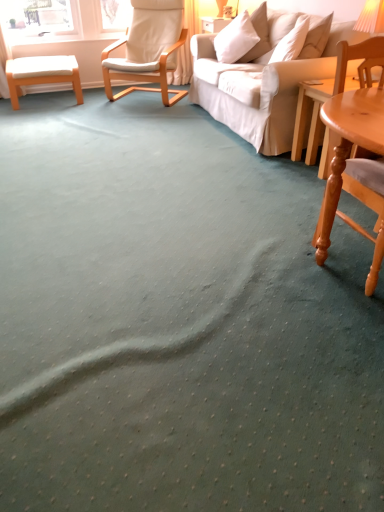
The height and width of the screenshot is (512, 384). I want to click on orange wood stool at left, so [x=42, y=74].

Where is `light wood chair at right, the 1th chair viewed from the right`? light wood chair at right, the 1th chair viewed from the right is located at coordinates (357, 198).

Identify the location of orange fabric lampshade at upper right. This screenshot has height=512, width=384. (371, 17).

Describe the element at coordinates (148, 49) in the screenshot. I see `white fabric chair at upper left, which ranks as the 2th chair in front-to-back order` at that location.

This screenshot has height=512, width=384. Find the location of `white soft pillow at upper right`. white soft pillow at upper right is located at coordinates (235, 39).

From the picture: From a real-world perspective, is light wood chair at right, the 1th chair viewed from the right, under white fabric chair at upper left, the second chair positioned from the right?

Yes, from a real-world perspective, light wood chair at right, the 1th chair viewed from the right, is beneath white fabric chair at upper left, the second chair positioned from the right.

Can you confirm if light wood chair at right, positioned as the first chair in front-to-back order, is wider than white fabric chair at upper left, the second chair positioned from the right?

No, light wood chair at right, positioned as the first chair in front-to-back order, is not wider than white fabric chair at upper left, the second chair positioned from the right.

Considering the points (367, 204) and (117, 77), which point is in front, point (367, 204) or point (117, 77)?

The point (367, 204) is closer.

Is white soft pillow at upper right at the right side of light wood chair at right, placed as the second chair when sorted from back to front?

No, white soft pillow at upper right is not to the right of light wood chair at right, placed as the second chair when sorted from back to front.

Looking at this image, would you say white soft pillow at upper right is inside or outside light wood chair at right, which is the 2th chair in top-to-bottom order?

white soft pillow at upper right is located beyond the bounds of light wood chair at right, which is the 2th chair in top-to-bottom order.

Locate an element on the screen. pillow behind the light wood chair at right, arranged as the first chair when ordered from the bottom is located at coordinates (235, 39).

Is white soft pillow at upper right further to the viewer compared to light wood chair at right, the 1th chair viewed from the right?

Yes, white soft pillow at upper right is further from the camera.

Could you tell me if white fabric chair at upper left, which ranks as the 2th chair in front-to-back order, is facing orange fabric lampshade at upper right?

No, white fabric chair at upper left, which ranks as the 2th chair in front-to-back order, is not turned towards orange fabric lampshade at upper right.

From a real-world perspective, between white fabric chair at upper left, which ranks as the 2th chair in front-to-back order, and orange fabric lampshade at upper right, who is vertically higher?

In real-world perspective, orange fabric lampshade at upper right is above.

Is white fabric chair at upper left, placed as the 1th chair when sorted from back to front, shorter than orange fabric lampshade at upper right?

No, white fabric chair at upper left, placed as the 1th chair when sorted from back to front, is not shorter than orange fabric lampshade at upper right.

From the image's perspective, is white soft pillow at upper right located above orange fabric lampshade at upper right?

Yes.

From a real-world perspective, is white soft pillow at upper right physically below orange fabric lampshade at upper right?

Yes, from a real-world perspective, white soft pillow at upper right is below orange fabric lampshade at upper right.

Which is behind, point (235, 42) or point (382, 0)?

Positioned behind is point (235, 42).

Does white soft pillow at upper right lie behind orange fabric lampshade at upper right?

Yes, it is.

Does white soft pillow at upper right have a lesser height compared to white fabric chair at upper left, which appears as the first chair when viewed from the top?

Yes.

Considering the sizes of objects white soft pillow at upper right and white fabric chair at upper left, the second chair positioned from the right, in the image provided, who is wider, white soft pillow at upper right or white fabric chair at upper left, the second chair positioned from the right,?

Wider between the two is white fabric chair at upper left, the second chair positioned from the right.

Relative to white fabric chair at upper left, which ranks as the 2th chair in front-to-back order, is white soft pillow at upper right in front or behind?

Visually, white soft pillow at upper right is located in front of white fabric chair at upper left, which ranks as the 2th chair in front-to-back order.

From the image's perspective, is white soft pillow at upper right located beneath white fabric chair at upper left, which ranks as the 2th chair in front-to-back order?

Yes, from the image's perspective, white soft pillow at upper right is below white fabric chair at upper left, which ranks as the 2th chair in front-to-back order.

Does white soft pillow at upper right have a smaller size compared to orange wood stool at left?

Yes.

Is white soft pillow at upper right oriented away from orange wood stool at left?

No, white soft pillow at upper right is not facing away from orange wood stool at left.

Is white soft pillow at upper right inside or outside of orange wood stool at left?

white soft pillow at upper right lies outside orange wood stool at left.

From the image's perspective, is white soft pillow at upper right above orange wood stool at left?

Yes, from the image's perspective, white soft pillow at upper right is above orange wood stool at left.

Is white fabric chair at upper left, placed as the 1th chair when sorted from back to front, surrounding white soft pillow at upper right?

No, white soft pillow at upper right is not surrounded by white fabric chair at upper left, placed as the 1th chair when sorted from back to front.

Considering the relative sizes of white fabric chair at upper left, placed as the 2th chair when sorted from bottom to top, and white soft pillow at upper right in the image provided, is white fabric chair at upper left, placed as the 2th chair when sorted from bottom to top, taller than white soft pillow at upper right?

Correct, white fabric chair at upper left, placed as the 2th chair when sorted from bottom to top, is much taller as white soft pillow at upper right.

Is white fabric chair at upper left, placed as the 2th chair when sorted from bottom to top, facing towards white soft pillow at upper right?

No, white fabric chair at upper left, placed as the 2th chair when sorted from bottom to top, is not oriented towards white soft pillow at upper right.

Is white fabric chair at upper left, which ranks as the 2th chair in front-to-back order, behind white soft pillow at upper right?

Yes, white fabric chair at upper left, which ranks as the 2th chair in front-to-back order, is further from the viewer.

Find the location of a particular element. chair above the light wood chair at right, the 2th chair viewed from the left (from a real-world perspective) is located at coordinates (148, 49).

I want to click on pillow on the left side of light wood chair at right, positioned as the first chair in front-to-back order, so click(235, 39).

Which object lies further to the anchor point orange wood stool at left, white fabric chair at upper left, placed as the 1th chair when sorted from back to front, or white soft pillow at upper right?

The object further to orange wood stool at left is white soft pillow at upper right.

Estimate the real-world distances between objects in this image. Which object is further from light wood chair at right, placed as the second chair when sorted from back to front, orange fabric lampshade at upper right or white soft pillow at upper right?

white soft pillow at upper right.

From the picture: Estimate the real-world distances between objects in this image. Which object is further from white soft pillow at upper right, white fabric chair at upper left, which ranks as the 2th chair in front-to-back order, or light brown wooden coffee table at right?

The object further to white soft pillow at upper right is light brown wooden coffee table at right.

Looking at this image, looking at the image, which one is located further to orange wood stool at left, white fabric chair at upper left, the second chair positioned from the right, or light wood chair at right, positioned as the first chair in front-to-back order?

light wood chair at right, positioned as the first chair in front-to-back order, is positioned further to the anchor orange wood stool at left.

Looking at the image, which one is located further to white soft pillow at upper right, orange wood stool at left or orange fabric lampshade at upper right?

Among the two, orange wood stool at left is located further to white soft pillow at upper right.

Considering their positions, is light brown wooden coffee table at right positioned closer to orange fabric lampshade at upper right than orange wood stool at left?

Based on the image, light brown wooden coffee table at right appears to be nearer to orange fabric lampshade at upper right.

Based on the photo, based on their spatial positions, is orange fabric lampshade at upper right or white fabric chair at upper left, placed as the 2th chair when sorted from bottom to top, closer to light wood chair at right, positioned as the first chair in front-to-back order?

orange fabric lampshade at upper right lies closer to light wood chair at right, positioned as the first chair in front-to-back order, than the other object.

Considering their positions, is light brown wooden coffee table at right positioned closer to light wood chair at right, placed as the second chair when sorted from back to front, than white soft pillow at upper right?

Based on the image, light brown wooden coffee table at right appears to be nearer to light wood chair at right, placed as the second chair when sorted from back to front.

You are a GUI agent. You are given a task and a screenshot of the screen. Output one action in this format:
    pyautogui.click(x=<x>, y=<y>)
    Task: Click on the table lamp positioned between light wood chair at right, the 1th chair viewed from the right, and white fabric chair at upper left, the first chair from the left, from near to far
    This screenshot has width=384, height=512.
    Given the screenshot: What is the action you would take?
    pyautogui.click(x=371, y=17)

The width and height of the screenshot is (384, 512). In order to click on pillow between light wood chair at right, positioned as the first chair in front-to-back order, and orange wood stool at left in the front-back direction in this screenshot , I will do `click(235, 39)`.

Locate an element on the screen. table lamp positioned between light wood chair at right, positioned as the first chair in front-to-back order, and light brown wooden coffee table at right from near to far is located at coordinates (371, 17).

At what (x,y) coordinates should I click in order to perform the action: click on pillow between orange wood stool at left and light brown wooden coffee table at right from left to right. Please return your answer as a coordinate pair (x, y). Looking at the image, I should click on (235, 39).